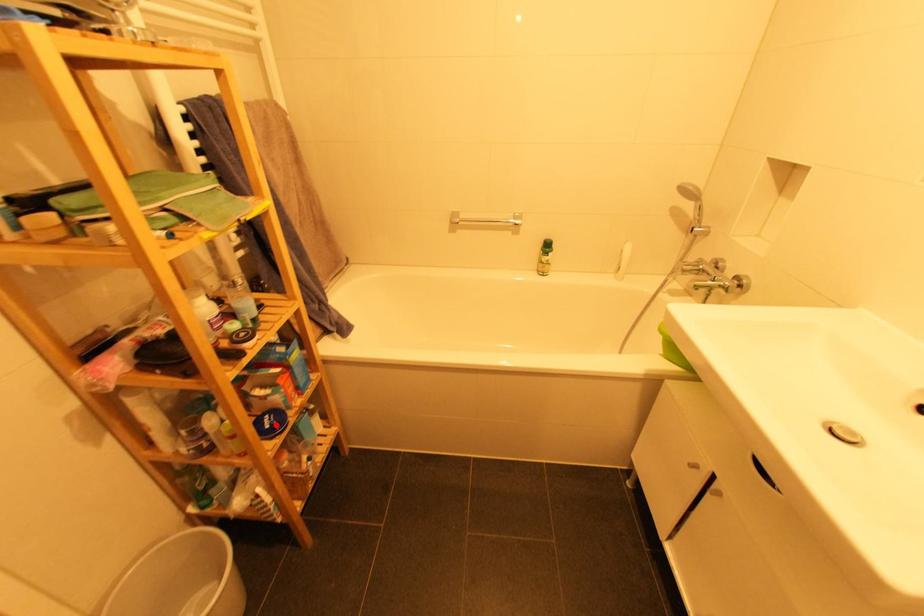
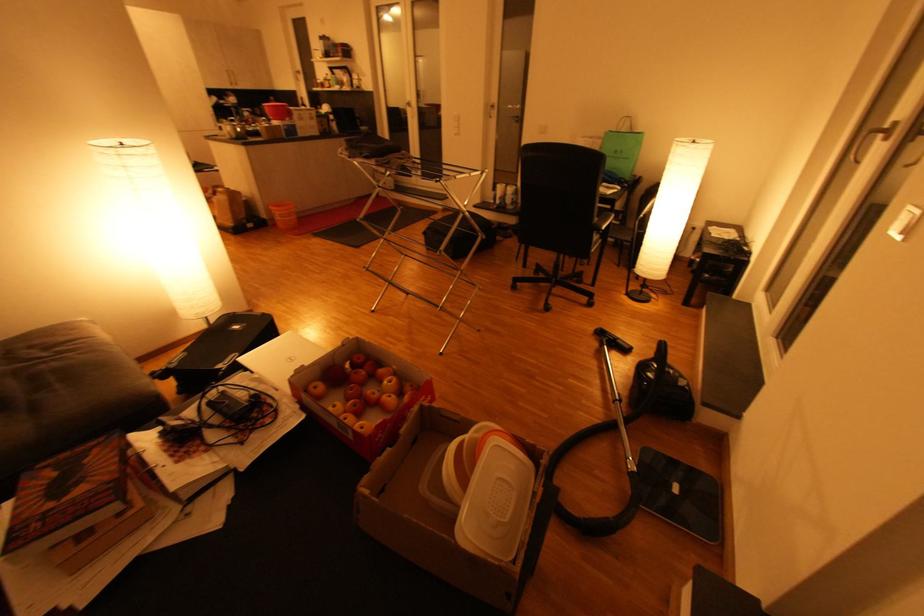
Question: I am providing you with two images of the same scene from different viewpoints. A red point is marked on the first image. At the location where the point appears in image 1, is it still visible in image 2?

Choices:
 (A) Yes
 (B) No

Answer: (B)